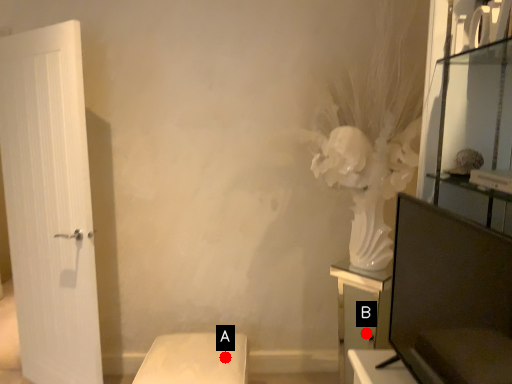
Question: Two points are circled on the image, labeled by A and B beside each circle. Which point appears farthest from the camera in this image?

Choices:
 (A) A is further
 (B) B is further

Answer: (B)